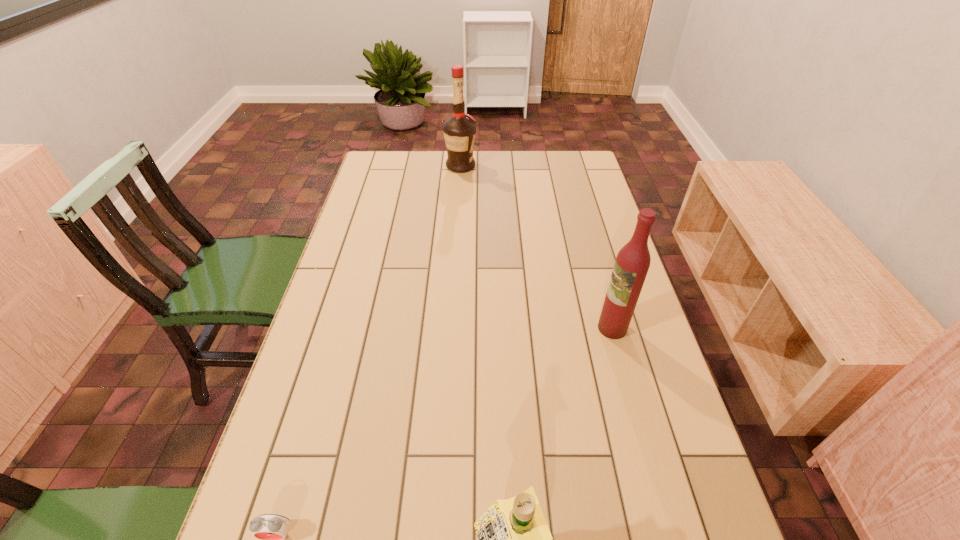
In the image, there is a desktop. Where is `free space at the far edge`? The height and width of the screenshot is (540, 960). free space at the far edge is located at coordinates (447, 180).

Where is `free spot at the left edge of the desktop`? The width and height of the screenshot is (960, 540). free spot at the left edge of the desktop is located at coordinates (323, 295).

Where is `vacant region at the right edge of the desktop`? vacant region at the right edge of the desktop is located at coordinates (560, 201).

At what (x,y) coordinates should I click in order to perform the action: click on vacant space at the far right corner of the desktop. Please return your answer as a coordinate pair (x, y). Looking at the image, I should click on (558, 166).

Select which object is the third closest to the second farthest object. Please provide its 2D coordinates. Your answer should be formatted as a tuple, i.e. [(x, y)], where the tuple contains the x and y coordinates of a point satisfying the conditions above.

[(459, 131)]

Identify which object is the third nearest to the farthest liquor. Please provide its 2D coordinates. Your answer should be formatted as a tuple, i.e. [(x, y)], where the tuple contains the x and y coordinates of a point satisfying the conditions above.

[(522, 539)]

Image resolution: width=960 pixels, height=540 pixels. What are the coordinates of `liquor that stands as the second closest to the second shortest object` in the screenshot? It's located at (459, 131).

Identify which liquor is located as the nearest to the nearest object. Please provide its 2D coordinates. Your answer should be formatted as a tuple, i.e. [(x, y)], where the tuple contains the x and y coordinates of a point satisfying the conditions above.

[(632, 263)]